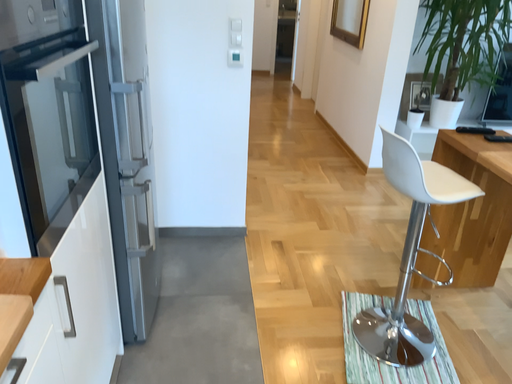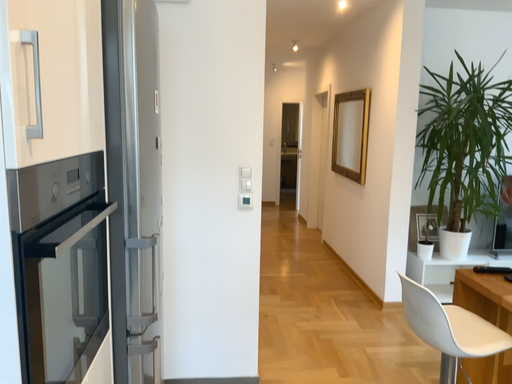
Question: Which way did the camera rotate in the video?

Choices:
 (A) rotated downward
 (B) rotated upward

Answer: (B)